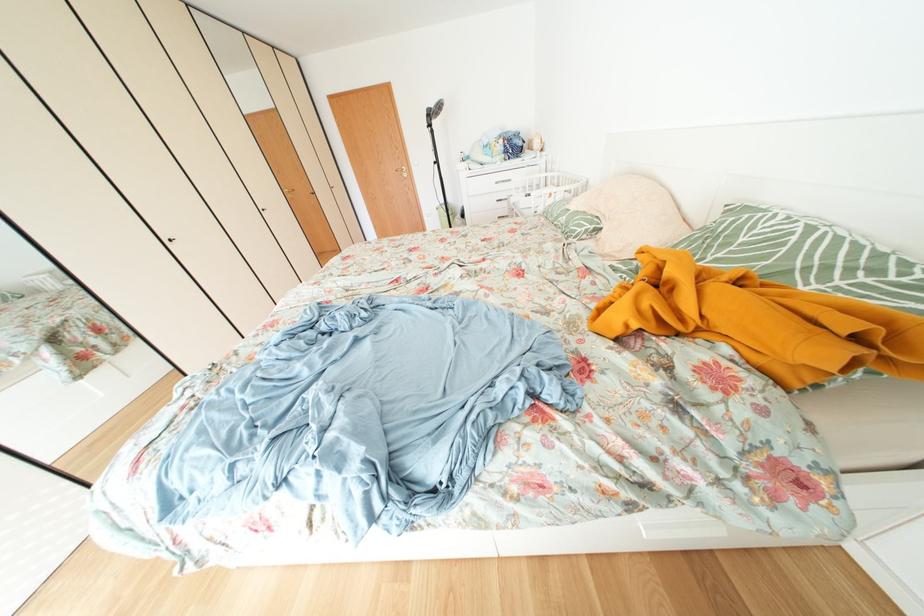
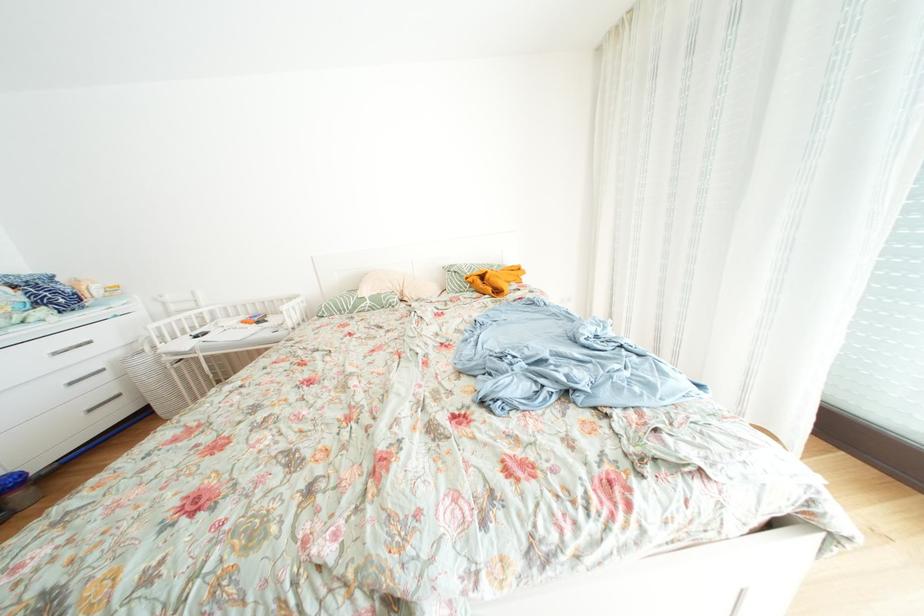
Where in the second image is the point corresponding to point 574,223 from the first image?

(378, 307)